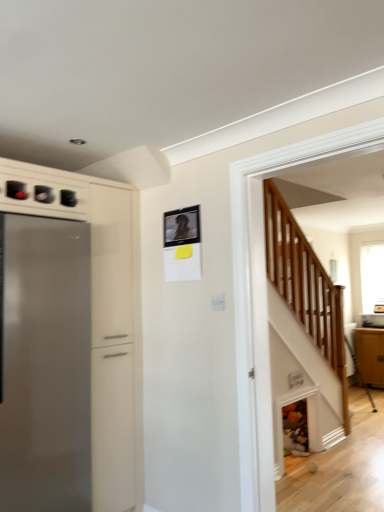
Question: In terms of width, does clear glass window at upper right look wider or thinner when compared to matte black picture frame at upper center?

Choices:
 (A) thin
 (B) wide

Answer: (B)

Question: Is clear glass window at upper right in front of or behind matte black picture frame at upper center in the image?

Choices:
 (A) behind
 (B) front

Answer: (A)

Question: Which object is the closest to the clear glass window at upper right?

Choices:
 (A) satin silver refrigerator at left
 (B) matte black picture frame at upper center
 (C) matte brown cabinet at right

Answer: (C)

Question: Which is farther from the matte black picture frame at upper center?

Choices:
 (A) satin silver refrigerator at left
 (B) clear glass window at upper right
 (C) matte brown cabinet at right

Answer: (B)